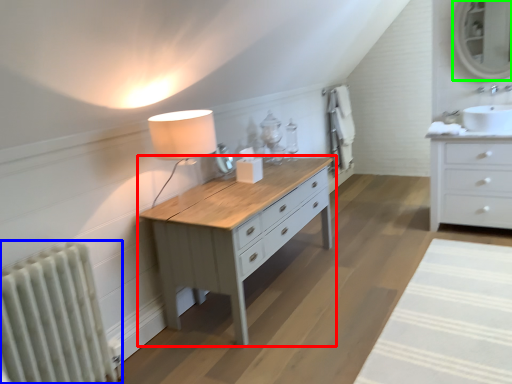
Question: Which is nearer to the table (highlighted by a red box)? radiator (highlighted by a blue box) or mirror (highlighted by a green box).

Choices:
 (A) radiator
 (B) mirror

Answer: (A)